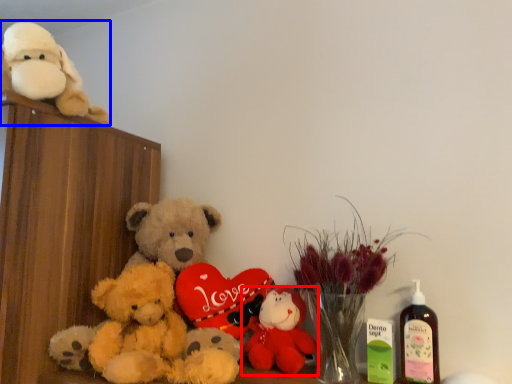
Question: Which object appears farthest to the camera in this image, toy (highlighted by a red box) or teddy bear (highlighted by a blue box)?

Choices:
 (A) toy
 (B) teddy bear

Answer: (A)